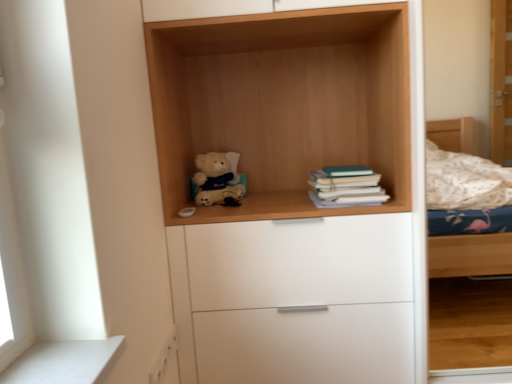
Find the location of a particular element. The width and height of the screenshot is (512, 384). vacant space to the left of teal matte book at center right is located at coordinates (277, 202).